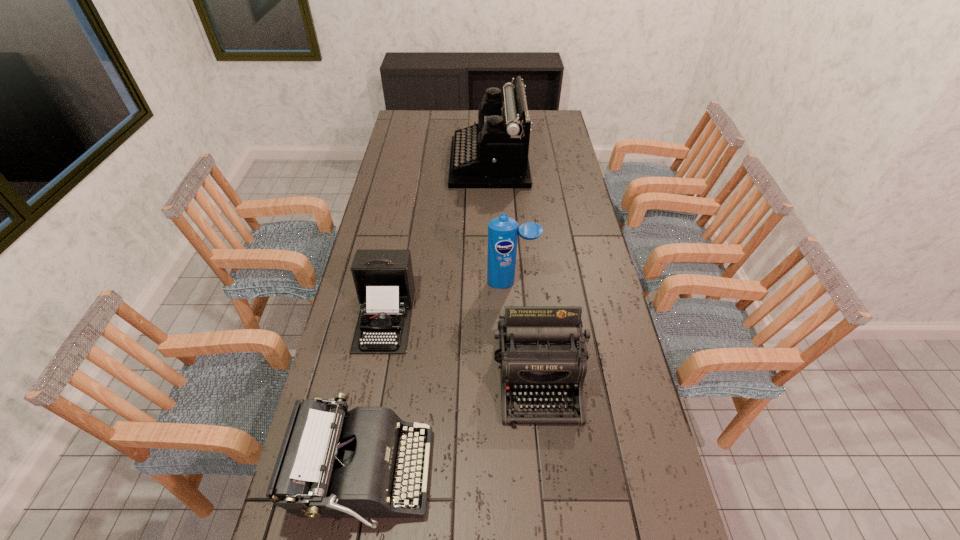
Locate an element on the screen. This screenshot has width=960, height=540. the farthest typewriter is located at coordinates tap(493, 153).

Locate an element on the screen. The image size is (960, 540). the tallest typewriter is located at coordinates coord(493,153).

You are a GUI agent. You are given a task and a screenshot of the screen. Output one action in this format:
    pyautogui.click(x=<x>, y=<y>)
    Task: Click on the shampoo
    
    Given the screenshot: What is the action you would take?
    pyautogui.click(x=503, y=231)

This screenshot has width=960, height=540. I want to click on vacant space located on the typing side of the farthest object, so click(391, 163).

The width and height of the screenshot is (960, 540). I want to click on free space located 0.260m on the typing side of the farthest object, so 395,163.

I want to click on free region located 0.190m on the typing side of the farthest object, so click(410, 163).

Where is `vacant space positioned 0.160m on the front of the shampoo`? vacant space positioned 0.160m on the front of the shampoo is located at coordinates (515, 327).

Where is `object that is at the left edge`? The image size is (960, 540). object that is at the left edge is located at coordinates (384, 282).

This screenshot has height=540, width=960. Find the location of `object that is at the right edge`. object that is at the right edge is located at coordinates (538, 351).

In the image, there is a desktop. In order to click on vacant area at the far edge in this screenshot , I will do `click(430, 126)`.